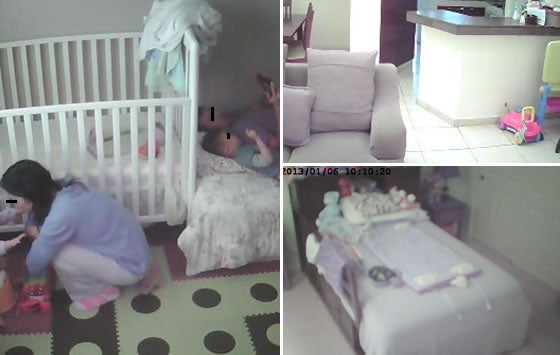
The image size is (560, 355). In order to click on rug in this screenshot , I will do coord(209,329).